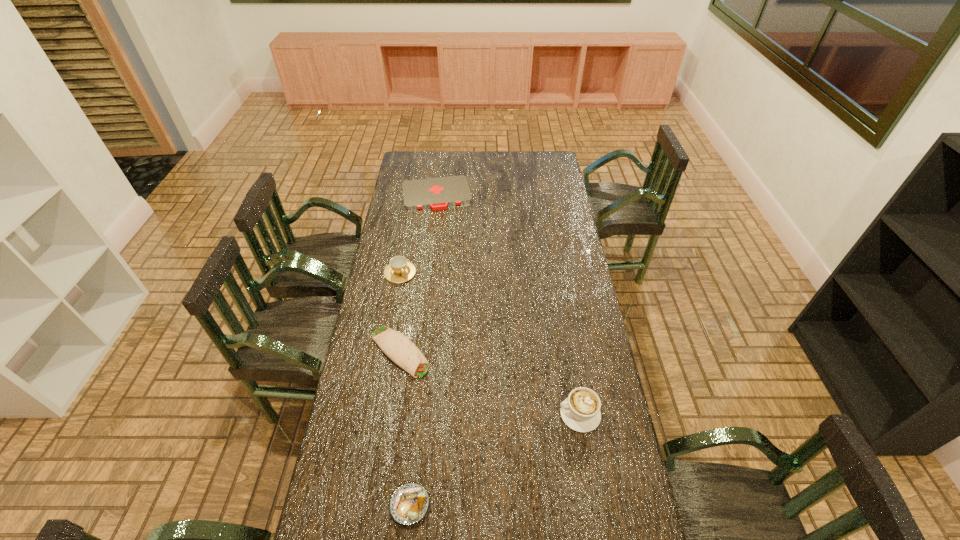
Identify which object is the third closest to the cup. Please provide its 2D coordinates. Your answer should be formatted as a tuple, i.e. [(x, y)], where the tuple contains the x and y coordinates of a point satisfying the conditions above.

[(580, 411)]

Find the location of a particular element. vacant region that satisfies the following two spatial constraints: 1. on the back side of the farthest object; 2. on the right side of the fourth shortest object is located at coordinates (414, 194).

The height and width of the screenshot is (540, 960). I want to click on blank area in the image that satisfies the following two spatial constraints: 1. on the front side of the cup; 2. to the right of the tallest object's handle, so click(375, 414).

Identify the location of vacant point that satisfies the following two spatial constraints: 1. on the back side of the nearest object; 2. to the right of the fourth farthest object's handle. (420, 414).

Find the location of a particular element. free point that satisfies the following two spatial constraints: 1. on the front side of the pastry; 2. on the left side of the burrito is located at coordinates (377, 505).

This screenshot has width=960, height=540. Find the location of `vacant space that satisfies the following two spatial constraints: 1. on the front side of the shortest object; 2. to the right of the cappuccino's handle`. vacant space that satisfies the following two spatial constraints: 1. on the front side of the shortest object; 2. to the right of the cappuccino's handle is located at coordinates (411, 414).